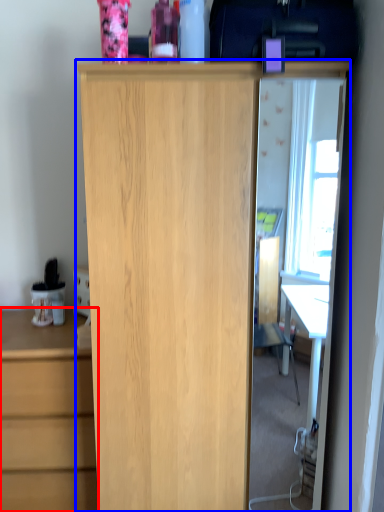
Question: Which of the following is the closest to the observer, chest of drawers (highlighted by a red box) or cupboard (highlighted by a blue box)?

Choices:
 (A) chest of drawers
 (B) cupboard

Answer: (B)